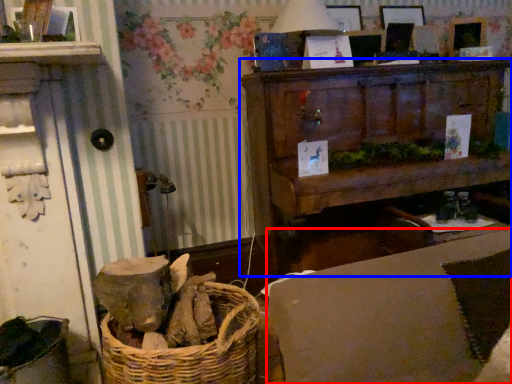
Question: Which of the following is the closest to the observer, couch (highlighted by a red box) or furniture (highlighted by a blue box)?

Choices:
 (A) couch
 (B) furniture

Answer: (A)